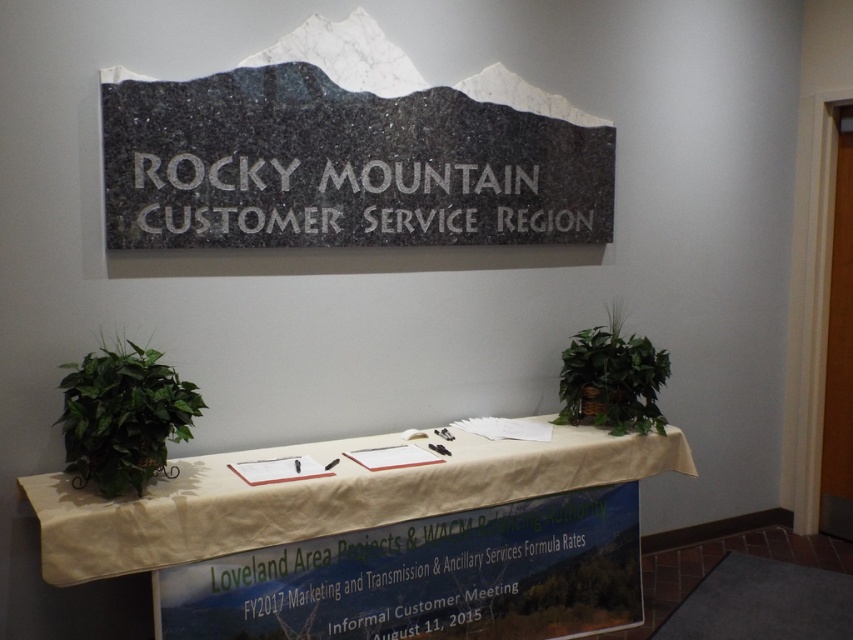
At what (x,y) coordinates should I click in order to perform the action: click on beige fabric-covered table at center. Please return your answer as a coordinate pair (x, y). The width and height of the screenshot is (853, 640). Looking at the image, I should click on (316, 497).

Looking at this image, which is more to the right, beige fabric-covered table at center or green leafy plant at center?

Positioned to the right is green leafy plant at center.

Where is `beige fabric-covered table at center`? beige fabric-covered table at center is located at coordinates (316, 497).

Which of these two, granite sign at center or green leafy plant at center, stands shorter?

green leafy plant at center

Does granite sign at center appear over green leafy plant at center?

Yes.

Measure the distance between granite sign at center and camera.

granite sign at center is 7.61 feet from camera.

Identify the location of granite sign at center. The height and width of the screenshot is (640, 853). (341, 166).

Does granite sign at center appear on the left side of white engraved text at center?

Yes, granite sign at center is to the left of white engraved text at center.

Is point (485, 212) closer to viewer compared to point (502, 243)?

Yes.

This screenshot has height=640, width=853. Find the location of `granite sign at center`. granite sign at center is located at coordinates (341, 166).